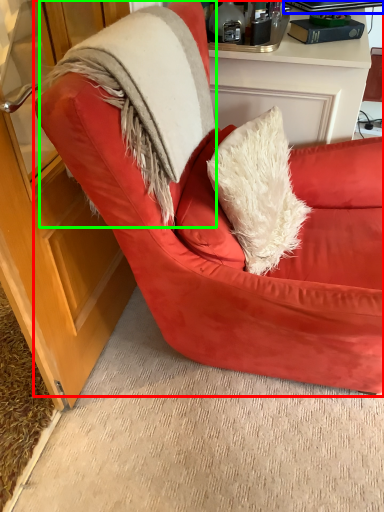
Question: Estimate the real-world distances between objects in this image. Which object is farther from chair (highlighted by a red box), laptop (highlighted by a blue box) or fur coat (highlighted by a green box)?

Choices:
 (A) laptop
 (B) fur coat

Answer: (A)